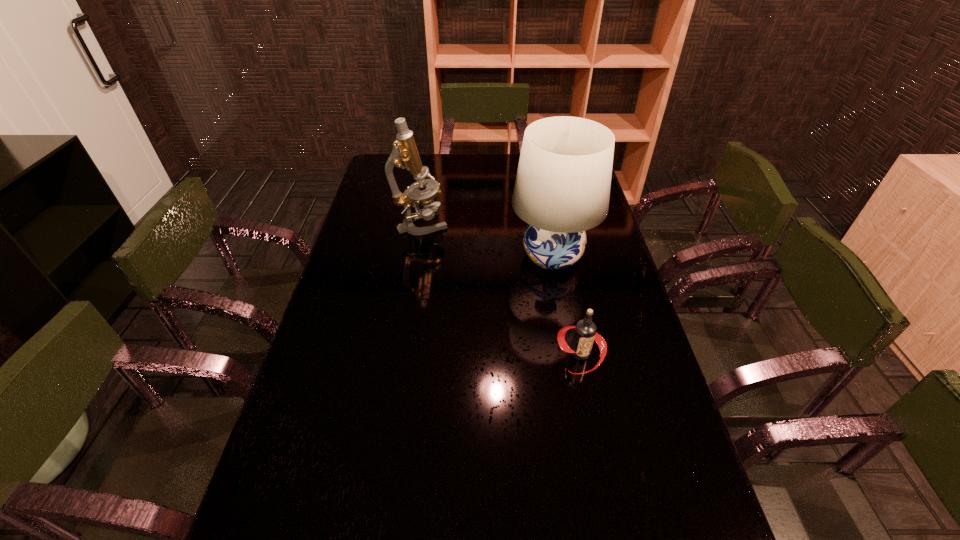
The height and width of the screenshot is (540, 960). In order to click on lampshade present at the right edge in this screenshot , I will do `click(562, 188)`.

Locate an element on the screen. The image size is (960, 540). root beer located in the right edge section of the desktop is located at coordinates (585, 333).

This screenshot has height=540, width=960. Identify the location of vacant space at the far edge of the desktop. (446, 168).

The width and height of the screenshot is (960, 540). Find the location of `blank area at the left edge`. blank area at the left edge is located at coordinates (394, 218).

Locate an element on the screen. The image size is (960, 540). vacant space at the right edge of the desktop is located at coordinates (629, 382).

Identify the location of free area in between the shortest object and the microscope. (501, 289).

Locate an element on the screen. This screenshot has height=540, width=960. free space that is in between the lampshade and the root beer is located at coordinates (566, 305).

Where is `vacant region between the root beer and the microscope`? The height and width of the screenshot is (540, 960). vacant region between the root beer and the microscope is located at coordinates (501, 289).

Identify the location of free space between the lampshade and the root beer. This screenshot has width=960, height=540. (566, 305).

Identify which object is the second nearest to the lampshade. Please provide its 2D coordinates. Your answer should be formatted as a tuple, i.e. [(x, y)], where the tuple contains the x and y coordinates of a point satisfying the conditions above.

[(405, 155)]